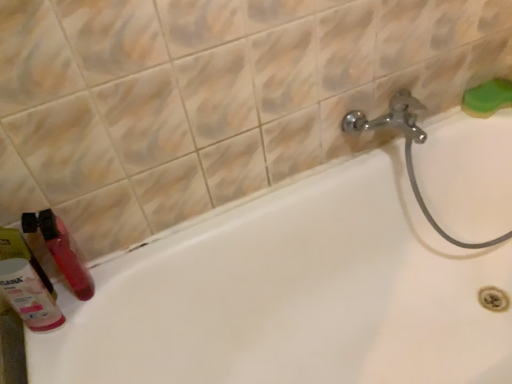
At what (x,y) coordinates should I click in order to perform the action: click on matte plastic toothbrush at lower left. Please return your answer as a coordinate pair (x, y). The width and height of the screenshot is (512, 384). Looking at the image, I should click on (27, 284).

What do you see at coordinates (27, 284) in the screenshot? I see `matte plastic toothbrush at lower left` at bounding box center [27, 284].

The image size is (512, 384). What do you see at coordinates (487, 98) in the screenshot?
I see `green sponge at upper right` at bounding box center [487, 98].

What do you see at coordinates (293, 295) in the screenshot? I see `white glossy bathtub at lower left` at bounding box center [293, 295].

Measure the distance between point (6, 262) and camera.

They are 29.25 inches apart.

Where is `matte plastic toothbrush at lower left`? Image resolution: width=512 pixels, height=384 pixels. matte plastic toothbrush at lower left is located at coordinates (27, 284).

How different are the orientations of matte plastic toothbrush at lower left and white glossy bathtub at lower left in degrees?

There is a 0.173-degree angle between the facing directions of matte plastic toothbrush at lower left and white glossy bathtub at lower left.

From the picture: In the image, is matte plastic toothbrush at lower left on the left side or the right side of white glossy bathtub at lower left?

In the image, matte plastic toothbrush at lower left appears on the left side of white glossy bathtub at lower left.

Identify the location of bathtub located underneath the matte plastic toothbrush at lower left (from a real-world perspective). The height and width of the screenshot is (384, 512). (293, 295).

Considering the positions of point (12, 280) and point (173, 311), is point (12, 280) closer or farther from the camera than point (173, 311)?

Point (12, 280) is positioned closer to the camera compared to point (173, 311).

How many degrees apart are the facing directions of green sponge at upper right and matte plastic toothbrush at lower left?

The facing directions of green sponge at upper right and matte plastic toothbrush at lower left are 1.32 degrees apart.

Do you think green sponge at upper right is within matte plastic toothbrush at lower left, or outside of it?

The correct answer is: outside.

Find the location of a particular element. The height and width of the screenshot is (384, 512). soap behind the matte plastic toothbrush at lower left is located at coordinates (487, 98).

Is green sponge at upper right closer to camera compared to matte plastic toothbrush at lower left?

No, green sponge at upper right is behind matte plastic toothbrush at lower left.

Who is more distant, matte pink bottle at lower left or green sponge at upper right?

green sponge at upper right is more distant.

Which object is positioned more to the right, matte pink bottle at lower left or green sponge at upper right?

From the viewer's perspective, green sponge at upper right appears more on the right side.

From a real-world perspective, is matte pink bottle at lower left over green sponge at upper right?

Yes, from a real-world perspective, matte pink bottle at lower left is on top of green sponge at upper right.

In terms of height, does matte pink bottle at lower left look taller or shorter compared to green sponge at upper right?

Clearly, matte pink bottle at lower left is taller compared to green sponge at upper right.

Considering the relative sizes of matte pink bottle at lower left and white glossy bathtub at lower left in the image provided, is matte pink bottle at lower left bigger than white glossy bathtub at lower left?

Actually, matte pink bottle at lower left might be smaller than white glossy bathtub at lower left.

Considering the sizes of objects matte pink bottle at lower left and white glossy bathtub at lower left in the image provided, who is thinner, matte pink bottle at lower left or white glossy bathtub at lower left?

matte pink bottle at lower left.

From a real-world perspective, is matte pink bottle at lower left on white glossy bathtub at lower left?

Yes, from a real-world perspective, matte pink bottle at lower left is over white glossy bathtub at lower left

Can you confirm if matte pink bottle at lower left is positioned to the right of white glossy bathtub at lower left?

No.

Which object is thinner, white glossy bathtub at lower left or green sponge at upper right?

Thinner between the two is green sponge at upper right.

Which point is more distant from viewer, (497, 212) or (495, 80)?

The point (497, 212) is farther from the camera.

Considering the sizes of white glossy bathtub at lower left and green sponge at upper right in the image, is white glossy bathtub at lower left taller or shorter than green sponge at upper right?

Clearly, white glossy bathtub at lower left is taller compared to green sponge at upper right.

Is white glossy bathtub at lower left oriented away from green sponge at upper right?

white glossy bathtub at lower left is not turned away from green sponge at upper right.

Considering the relative sizes of green sponge at upper right and white glossy bathtub at lower left in the image provided, is green sponge at upper right smaller than white glossy bathtub at lower left?

Yes.

Is green sponge at upper right inside or outside of white glossy bathtub at lower left?

green sponge at upper right is outside white glossy bathtub at lower left.

Considering the points (496, 95) and (330, 183), which point is in front, point (496, 95) or point (330, 183)?

The point (330, 183) is more forward.

Relative to white glossy bathtub at lower left, is green sponge at upper right in front or behind?

green sponge at upper right is behind white glossy bathtub at lower left.

Where is `cleaning product below the matte plastic toothbrush at lower left (from a real-world perspective)`? This screenshot has height=384, width=512. cleaning product below the matte plastic toothbrush at lower left (from a real-world perspective) is located at coordinates (29, 295).

Between matte plastic toothbrush at lower left and matte pink bottle at lower left, which one has larger size?

matte pink bottle at lower left.

Consider the image. Relative to matte pink bottle at lower left, is matte plastic toothbrush at lower left in front or behind?

In the image, matte plastic toothbrush at lower left appears behind matte pink bottle at lower left.

Is matte plastic toothbrush at lower left next to matte pink bottle at lower left?

Yes, matte plastic toothbrush at lower left is right next to matte pink bottle at lower left and making contact.

The height and width of the screenshot is (384, 512). Find the location of `toiletry above the white glossy bathtub at lower left (from a real-world perspective)`. toiletry above the white glossy bathtub at lower left (from a real-world perspective) is located at coordinates (27, 284).

The image size is (512, 384). Find the location of `soap that appears above the matte plastic toothbrush at lower left (from the image's perspective)`. soap that appears above the matte plastic toothbrush at lower left (from the image's perspective) is located at coordinates (487, 98).

Considering their positions, is white glossy bathtub at lower left positioned further to green sponge at upper right than matte plastic toothbrush at lower left?

matte plastic toothbrush at lower left is positioned further to the anchor green sponge at upper right.

Which object lies nearer to the anchor point green sponge at upper right, matte plastic toothbrush at lower left or white glossy bathtub at lower left?

white glossy bathtub at lower left is closer to green sponge at upper right.

Looking at the image, which one is located further to green sponge at upper right, matte pink bottle at lower left or white glossy bathtub at lower left?

matte pink bottle at lower left lies further to green sponge at upper right than the other object.

From the image, which object appears to be farther from white glossy bathtub at lower left, green sponge at upper right or matte pink bottle at lower left?

matte pink bottle at lower left is further to white glossy bathtub at lower left.

From the image, which object appears to be nearer to white glossy bathtub at lower left, matte plastic toothbrush at lower left or matte pink bottle at lower left?

Among the two, matte plastic toothbrush at lower left is located nearer to white glossy bathtub at lower left.

Which object lies nearer to the anchor point green sponge at upper right, matte pink bottle at lower left or matte plastic toothbrush at lower left?

matte plastic toothbrush at lower left is closer to green sponge at upper right.

Looking at the image, which one is located closer to matte pink bottle at lower left, matte plastic toothbrush at lower left or white glossy bathtub at lower left?

Among the two, matte plastic toothbrush at lower left is located nearer to matte pink bottle at lower left.

When comparing their distances from matte plastic toothbrush at lower left, does green sponge at upper right or matte pink bottle at lower left seem closer?

Based on the image, matte pink bottle at lower left appears to be nearer to matte plastic toothbrush at lower left.

Locate an element on the screen. This screenshot has width=512, height=384. cleaning product between matte plastic toothbrush at lower left and white glossy bathtub at lower left in the horizontal direction is located at coordinates (29, 295).

Locate an element on the screen. bathtub between matte plastic toothbrush at lower left and green sponge at upper right from left to right is located at coordinates pyautogui.click(x=293, y=295).

The width and height of the screenshot is (512, 384). Identify the location of bathtub between matte pink bottle at lower left and green sponge at upper right in the horizontal direction. (293, 295).

Where is `cleaning product between matte plastic toothbrush at lower left and green sponge at upper right from left to right`? This screenshot has height=384, width=512. cleaning product between matte plastic toothbrush at lower left and green sponge at upper right from left to right is located at coordinates (29, 295).